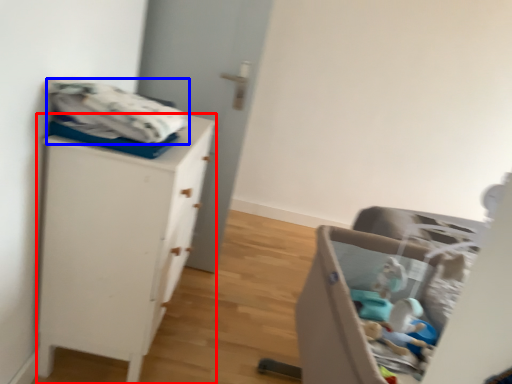
Question: Which of the following is the closest to the observer, chest of drawers (highlighted by a red box) or baby clothe (highlighted by a blue box)?

Choices:
 (A) chest of drawers
 (B) baby clothe

Answer: (B)